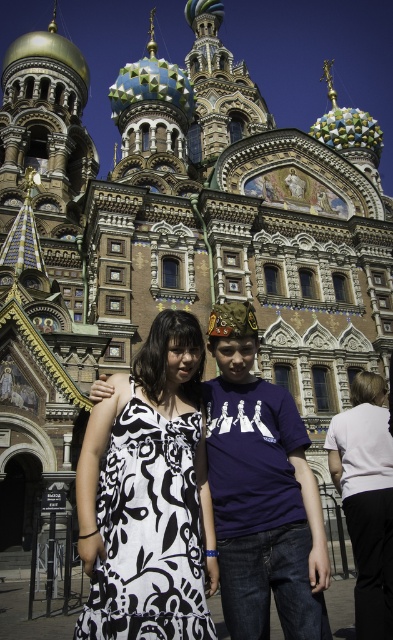
Can you confirm if black printed dress at center is taller than navy blue t-shirt at center?

Incorrect, black printed dress at center's height is not larger of navy blue t-shirt at center's.

Is point (179, 620) in front of point (284, 632)?

Yes.

The width and height of the screenshot is (393, 640). I want to click on black printed dress at center, so click(x=148, y=497).